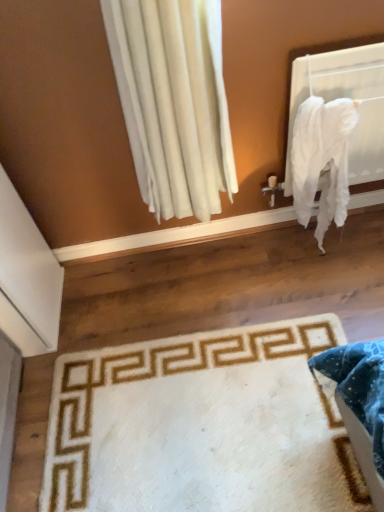
Locate an element on the screen. The width and height of the screenshot is (384, 512). vacant area that is situated to the right of white cotton blanket at right is located at coordinates (356, 253).